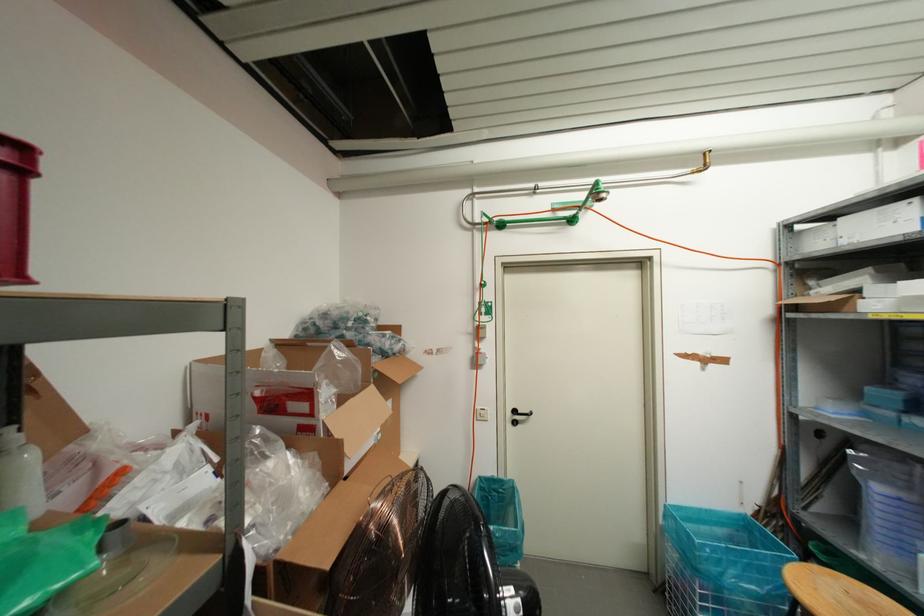
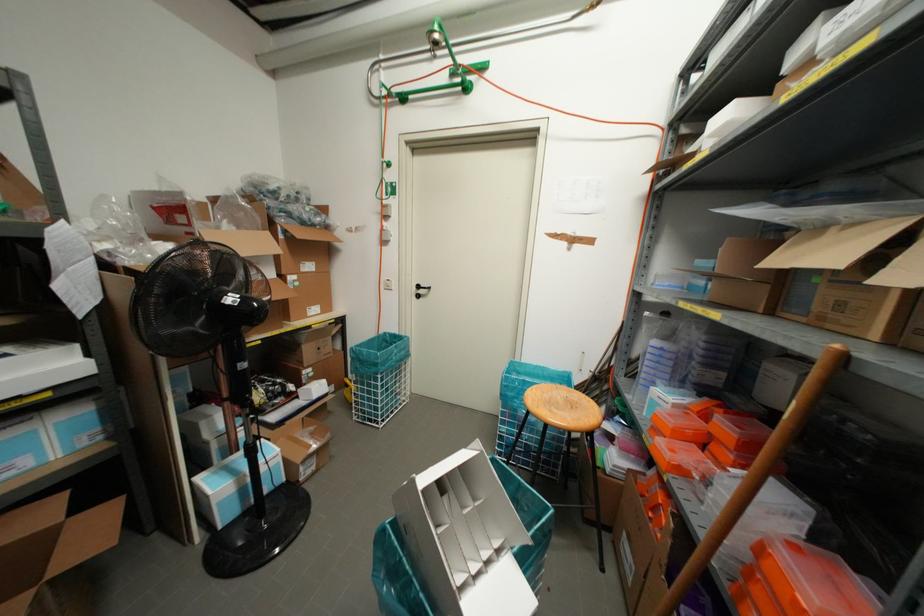
In the second image, find the point that corresponds to the point at 476,416 in the first image.

(382, 285)